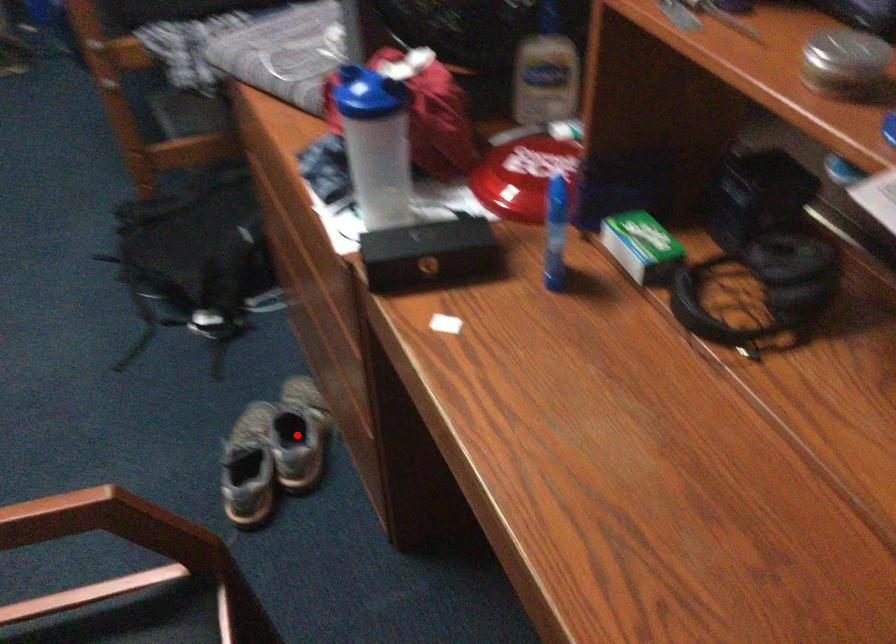
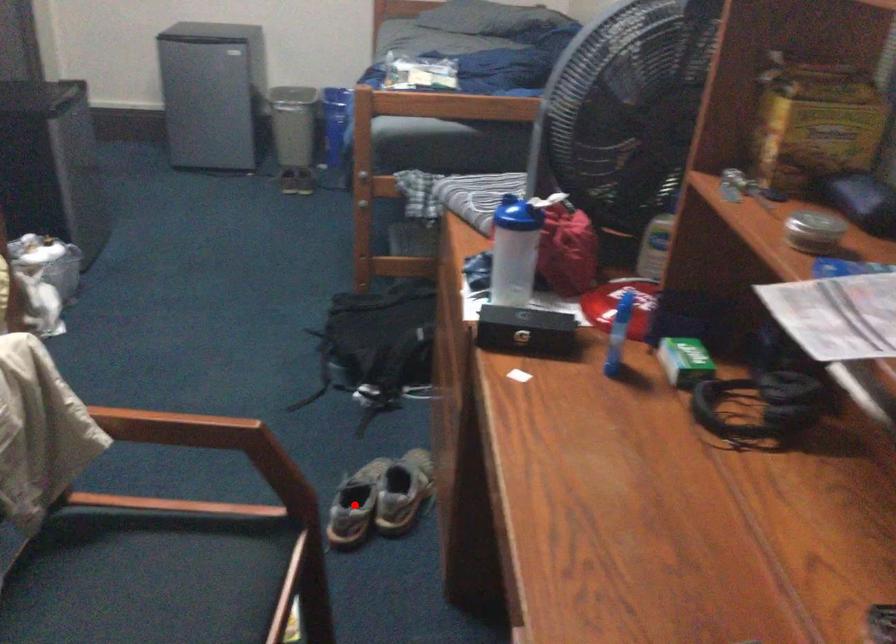
I am providing you with two images of the same scene from different viewpoints. A red point is marked on the first image and another point is marked on the second image. Do the highlighted points in image1 and image2 indicate the same real-world spot?

No